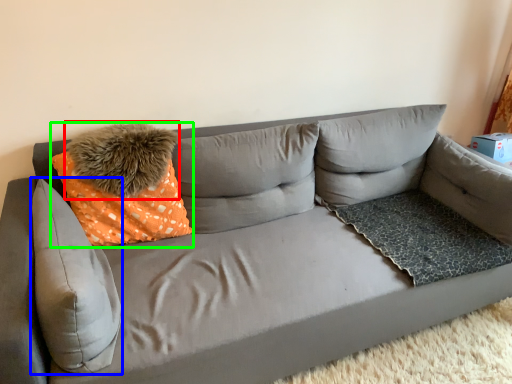
Question: Based on their relative distances, which object is nearer to pillow (highlighted by a red box)? Choose from pillow (highlighted by a blue box) and throw pillow (highlighted by a green box).

Choices:
 (A) pillow
 (B) throw pillow

Answer: (B)